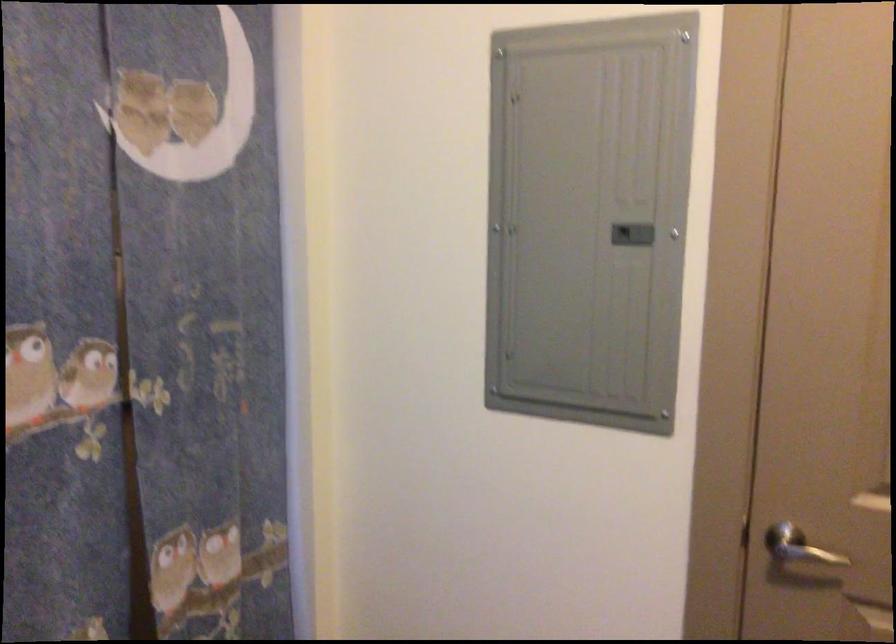
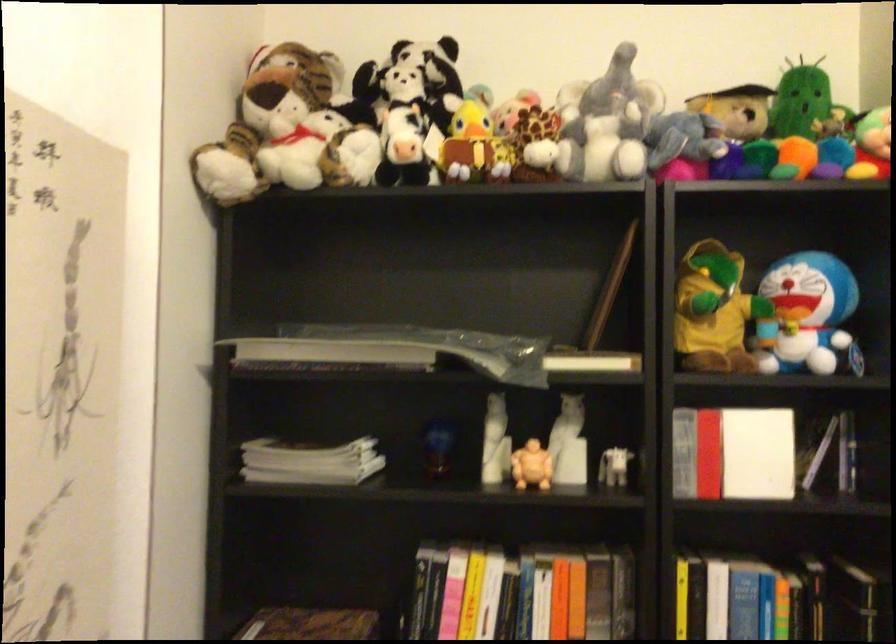
Question: The camera is either moving clockwise (left) or counter-clockwise (right) around the object. The first image is from the beginning of the video and the second image is from the end. Is the camera moving left or right when shooting the video?

Choices:
 (A) Left
 (B) Right

Answer: (A)